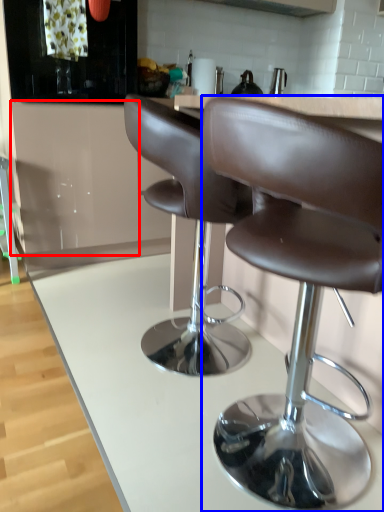
Question: Which object is further to the camera taking this photo, cabinetry (highlighted by a red box) or chair (highlighted by a blue box)?

Choices:
 (A) cabinetry
 (B) chair

Answer: (A)